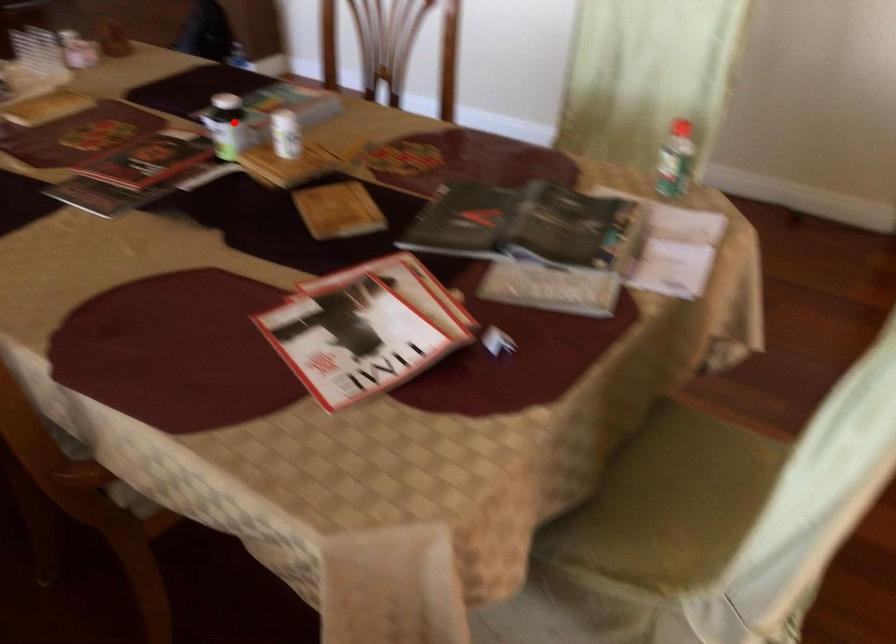
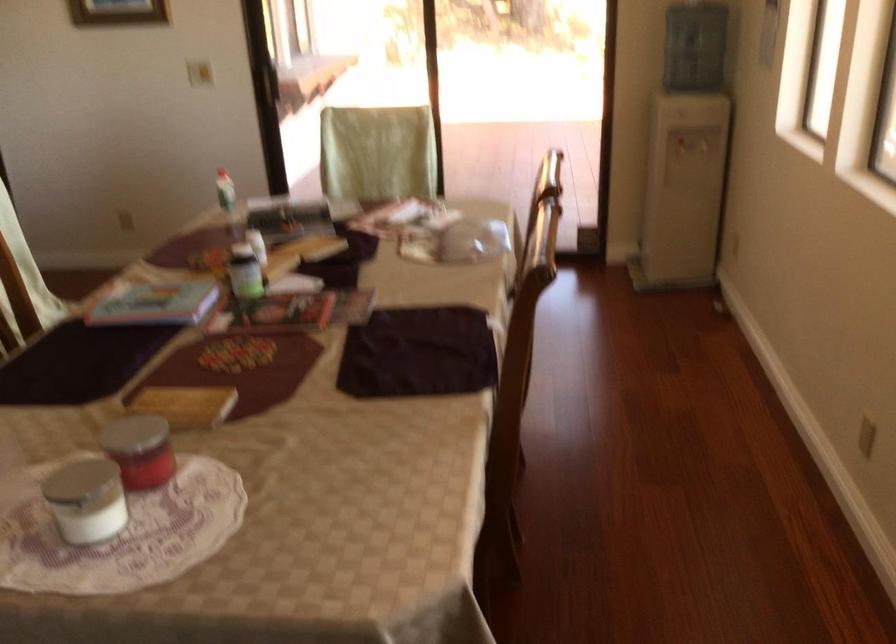
Question: I am providing you with two images of the same scene from different viewpoints. Given a red point in image1, look at the same physical point in image2. Is it:

Choices:
 (A) Closer to the viewpoint
 (B) Farther from the viewpoint

Answer: (B)